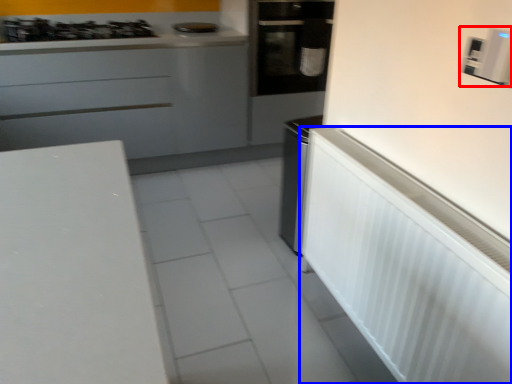
Question: Which of the following is the farthest to the observer, appliance (highlighted by a red box) or appliance (highlighted by a blue box)?

Choices:
 (A) appliance
 (B) appliance

Answer: (A)